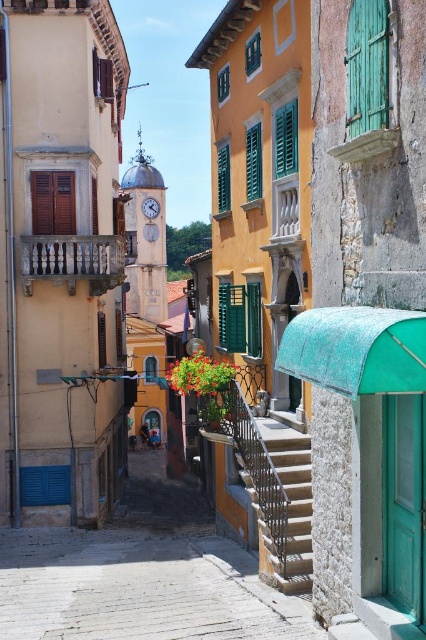
Looking at this image, you are standing at the entrance of the beige building with a balcony on the left side of the street. You want to reach the smooth stone steps at center. Which direction should you walk to get there?

You should walk towards the center of the street to reach the smooth stone steps at center, as they are located at the central point of the image.